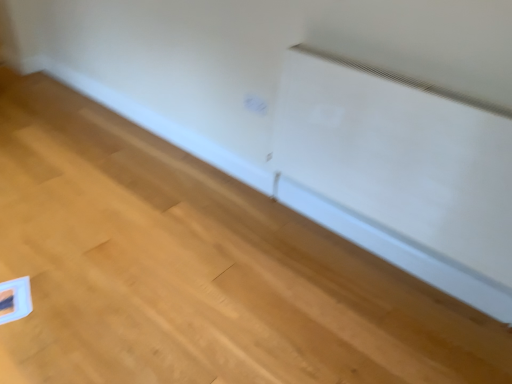
Image resolution: width=512 pixels, height=384 pixels. What are the coordinates of `free point to the left of white matte air conditioning at upper center` in the screenshot? It's located at (225, 255).